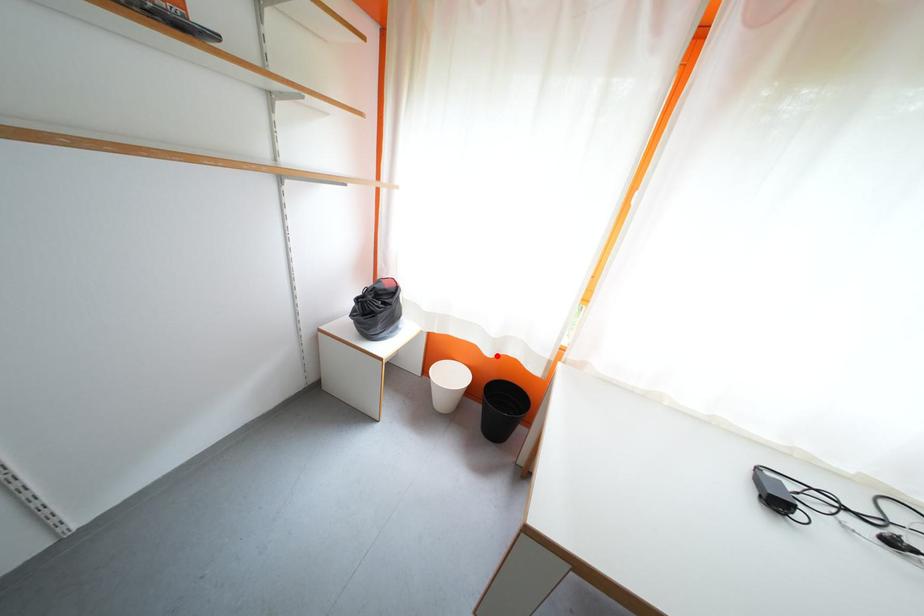
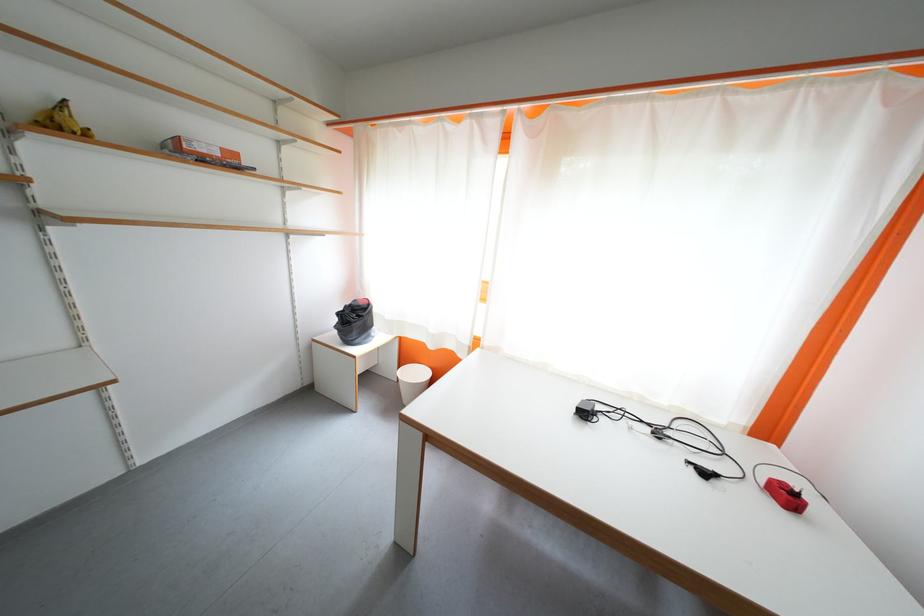
In the second image, find the point that corresponds to the highlighted location in the first image.

(440, 350)